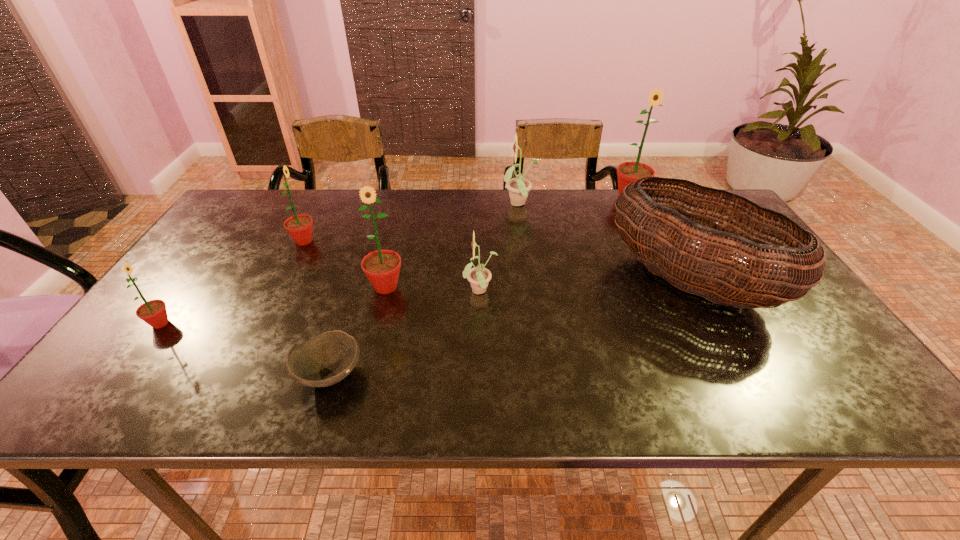
Identify the location of blank space that satisfies the following two spatial constraints: 1. on the face of the tallest object; 2. on the face of the second sunflower from left to right. (651, 241).

I want to click on free location that satisfies the following two spatial constraints: 1. on the face of the third green sunflower from right to left; 2. on the right side of the bowl, so click(x=237, y=374).